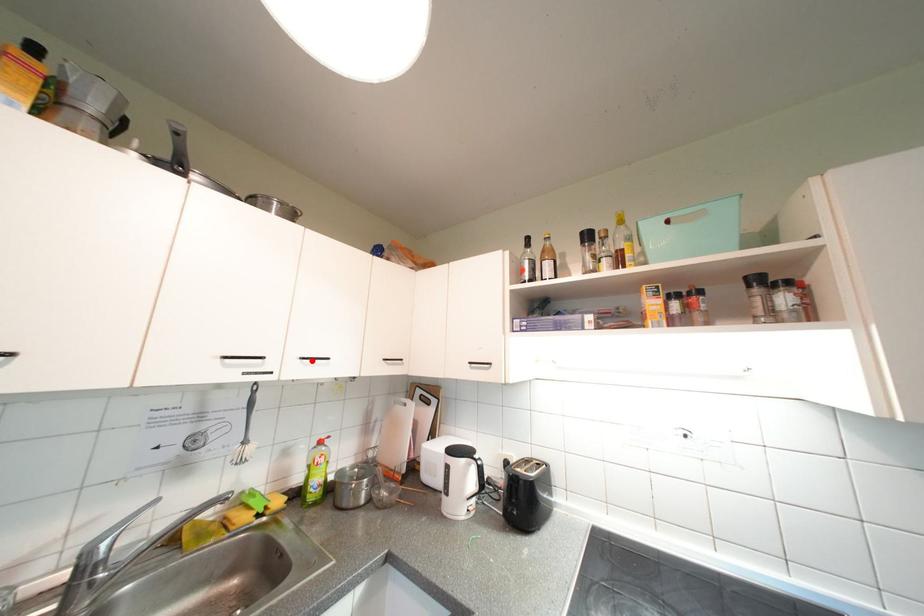
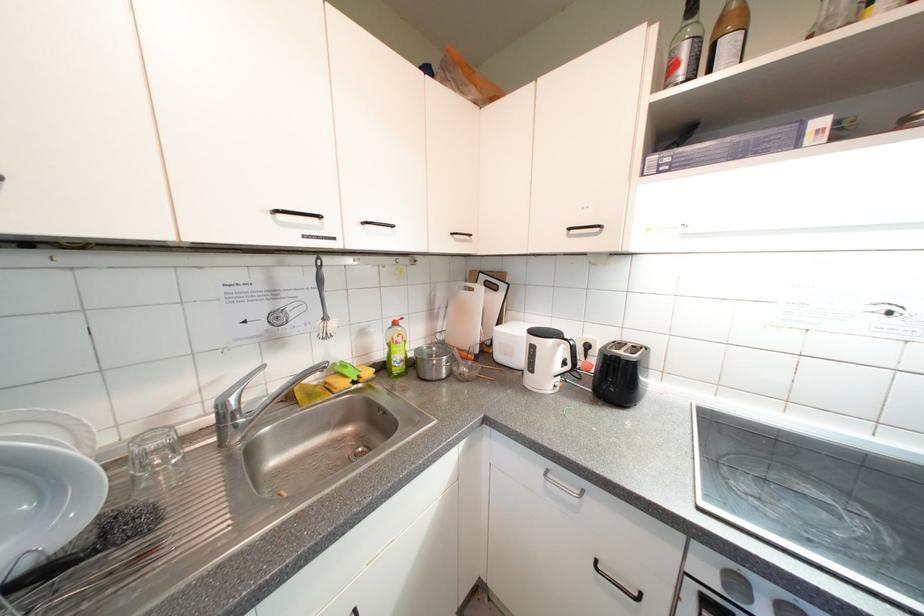
The point at the highlighted location is marked in the first image. Where is the corresponding point in the second image?

(373, 225)